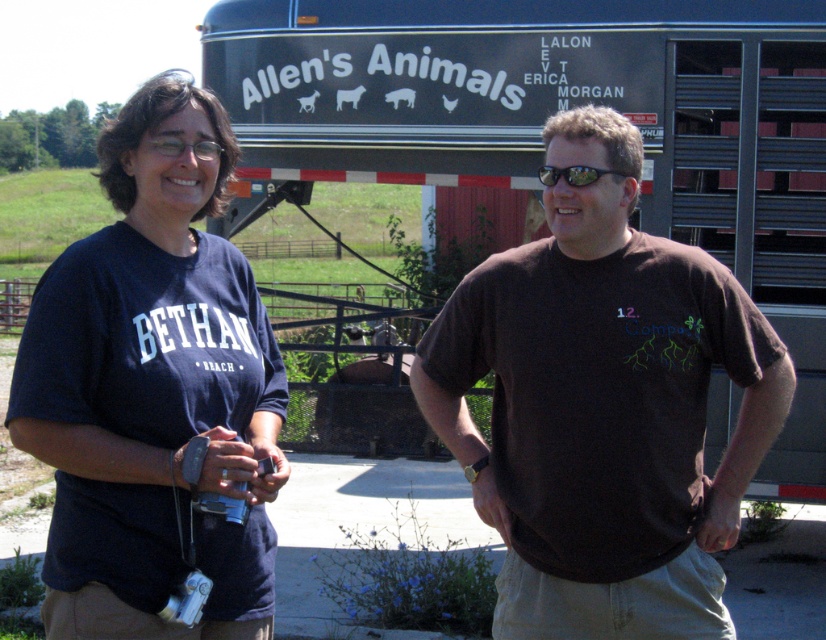
Looking at this image, is brown cotton t-shirt at center above dark blue t-shirt at left?

Actually, brown cotton t-shirt at center is below dark blue t-shirt at left.

Can you confirm if brown cotton t-shirt at center is positioned below dark blue t-shirt at left?

Yes, brown cotton t-shirt at center is below dark blue t-shirt at left.

Does point (624, 234) come in front of point (140, 227)?

No.

You are a GUI agent. You are given a task and a screenshot of the screen. Output one action in this format:
    pyautogui.click(x=<x>, y=<y>)
    Task: Click on the brown cotton t-shirt at center
    The height and width of the screenshot is (640, 826).
    Given the screenshot: What is the action you would take?
    [601, 406]

Which is behind, point (738, 109) or point (513, 602)?

The point (738, 109) is behind.

Is point (677, 113) closer to viewer compared to point (567, 256)?

No, it is not.

Who is more distant from viewer, (653, 124) or (464, 460)?

Positioned behind is point (653, 124).

The image size is (826, 640). I want to click on black trailer truck at center, so click(542, 122).

Is dark blue t-shirt at left shorter than black reflective sunglasses at center?

Incorrect, dark blue t-shirt at left's height does not fall short of black reflective sunglasses at center's.

Which is more to the left, dark blue t-shirt at left or black reflective sunglasses at center?

dark blue t-shirt at left is more to the left.

The width and height of the screenshot is (826, 640). I want to click on dark blue t-shirt at left, so click(x=153, y=388).

Where is `dark blue t-shirt at left`? The width and height of the screenshot is (826, 640). dark blue t-shirt at left is located at coordinates (153, 388).